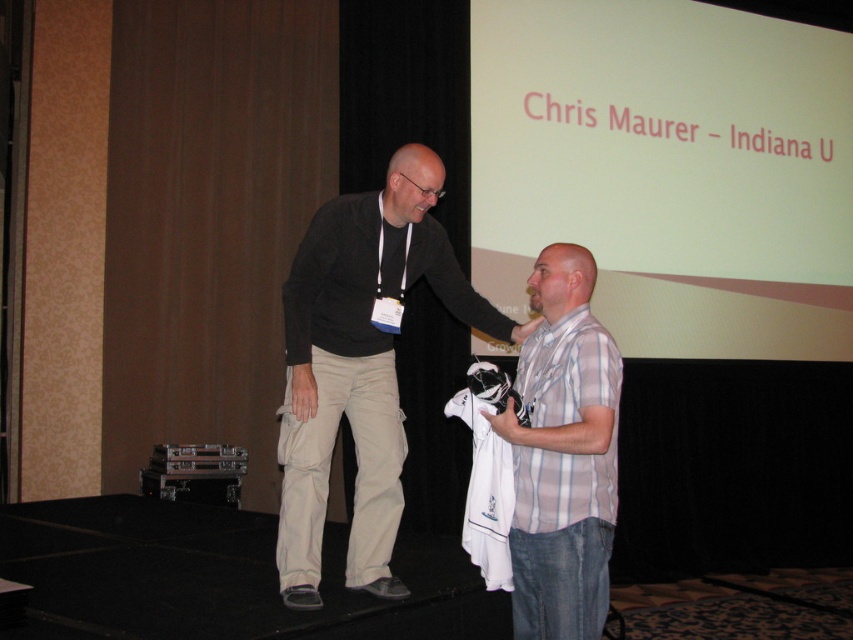
Question: Does khaki cotton pants at center have a smaller size compared to white striped shirt at center?

Choices:
 (A) yes
 (B) no

Answer: (B)

Question: Among these objects, which one is farthest from the camera?

Choices:
 (A) khaki cotton pants at center
 (B) white striped shirt at center

Answer: (A)

Question: Does khaki cotton pants at center appear on the left side of white striped shirt at center?

Choices:
 (A) yes
 (B) no

Answer: (A)

Question: Is khaki cotton pants at center above white striped shirt at center?

Choices:
 (A) no
 (B) yes

Answer: (B)